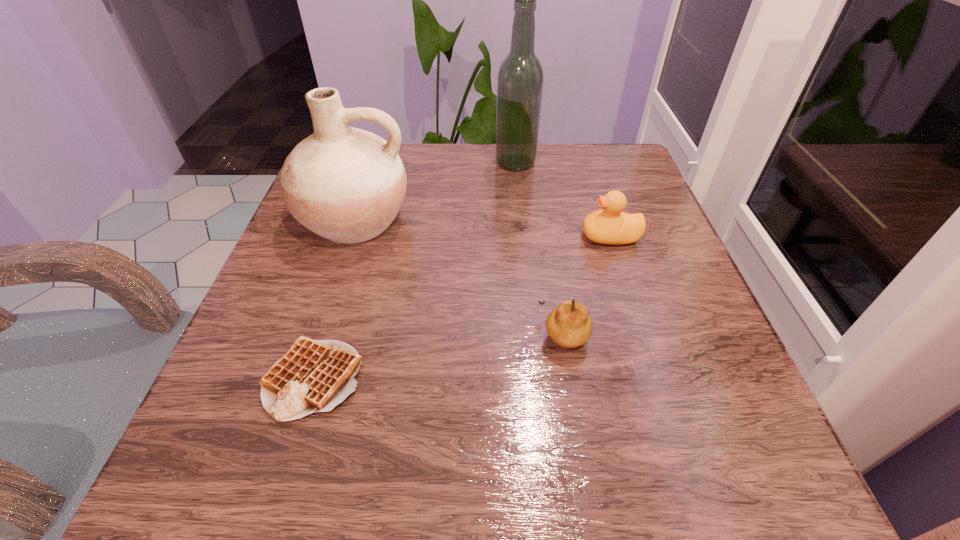
At what (x,y) coordinates should I click in order to perform the action: click on free region located on the face of the duck. Please return your answer as a coordinate pair (x, y). This screenshot has width=960, height=540. Looking at the image, I should click on tap(521, 237).

Locate an element on the screen. The image size is (960, 540). vacant area situated on the back of the pear is located at coordinates (540, 198).

What are the coordinates of `free spot located on the front of the waffle` in the screenshot? It's located at (285, 471).

Locate an element on the screen. The image size is (960, 540). liquor positioned at the far edge is located at coordinates (520, 78).

I want to click on pottery positioned at the far edge, so 345,184.

At what (x,y) coordinates should I click in order to perform the action: click on pottery located at the left edge. Please return your answer as a coordinate pair (x, y). This screenshot has width=960, height=540. Looking at the image, I should click on (345, 184).

Where is `waffle located at the left edge`? The image size is (960, 540). waffle located at the left edge is located at coordinates (313, 376).

In order to click on object present at the right edge in this screenshot , I will do `click(610, 225)`.

I want to click on object that is at the far left corner, so click(x=345, y=184).

Locate an element on the screen. free location at the far edge of the desktop is located at coordinates (558, 150).